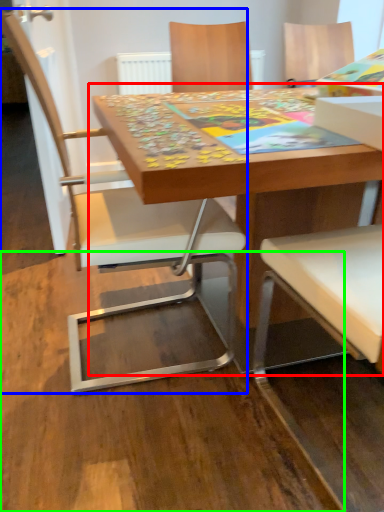
Question: Which object is the closest to the table (highlighted by a red box)? Choose among these: chair (highlighted by a blue box) or plywood (highlighted by a green box).

Choices:
 (A) chair
 (B) plywood

Answer: (A)